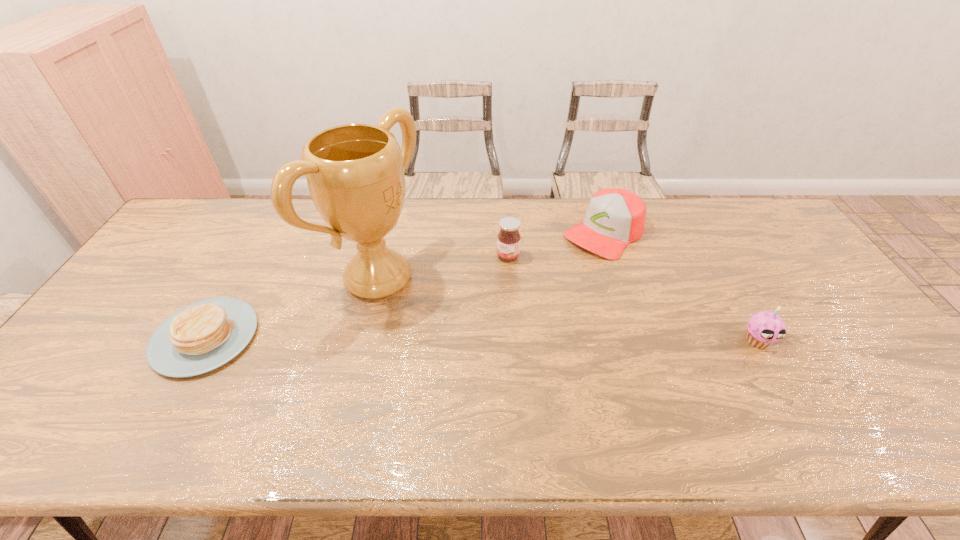
Where is `free spot on the desktop that is between the leftmost object and the cupcake and is positioned on the front-facing side of the fourth object from left to right`? The width and height of the screenshot is (960, 540). free spot on the desktop that is between the leftmost object and the cupcake and is positioned on the front-facing side of the fourth object from left to right is located at coordinates (486, 339).

I want to click on vacant space on the desktop that is between the pancake and the rightmost object and is positioned on the front of the tallest object with the decoration, so click(497, 339).

Identify the location of free spot on the desktop that is between the shortest object and the rightmost object and is positioned on the label side of the jam. The image size is (960, 540). (433, 339).